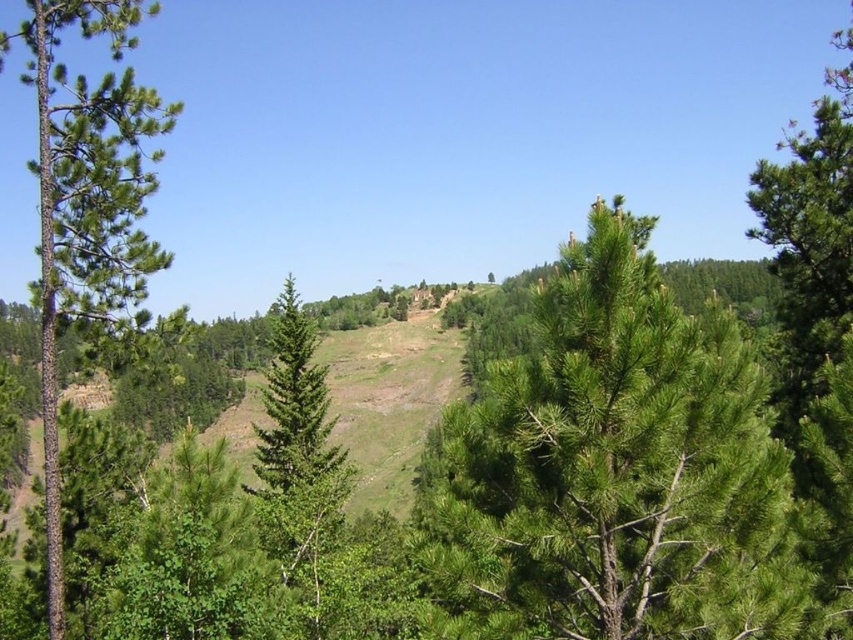
You are standing in the landscape and want to walk to both points. Which point, point [490,436] or point [107,20], will you reach first?

Point [490,436] is closer to the camera than point [107,20], so you will reach point [490,436] first.